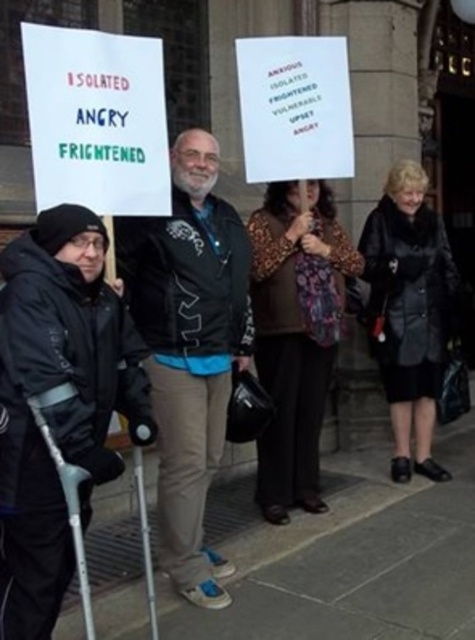
Question: Does black matte jacket at center appear on the left side of leopard print scarf at center?

Choices:
 (A) yes
 (B) no

Answer: (A)

Question: Based on their relative distances, which object is nearer to the leopard print scarf at center?

Choices:
 (A) black matte jacket at center
 (B) gray concrete pavement at lower center

Answer: (A)

Question: Among these points, which one is farthest from the camera?

Choices:
 (A) (233, 264)
 (B) (266, 611)

Answer: (A)

Question: Is the position of gray concrete pavement at lower center more distant than that of black matte jacket at center?

Choices:
 (A) no
 (B) yes

Answer: (A)

Question: Can you confirm if black matte jacket at center is smaller than leopard print scarf at center?

Choices:
 (A) no
 (B) yes

Answer: (A)

Question: Estimate the real-world distances between objects in this image. Which object is closer to the leopard print scarf at center?

Choices:
 (A) gray concrete pavement at lower center
 (B) black matte jacket at center

Answer: (B)